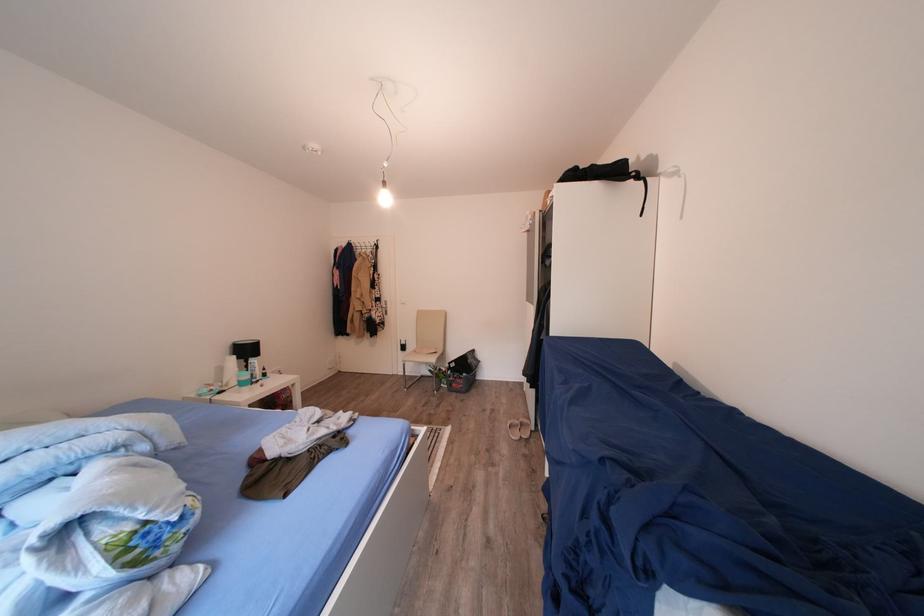
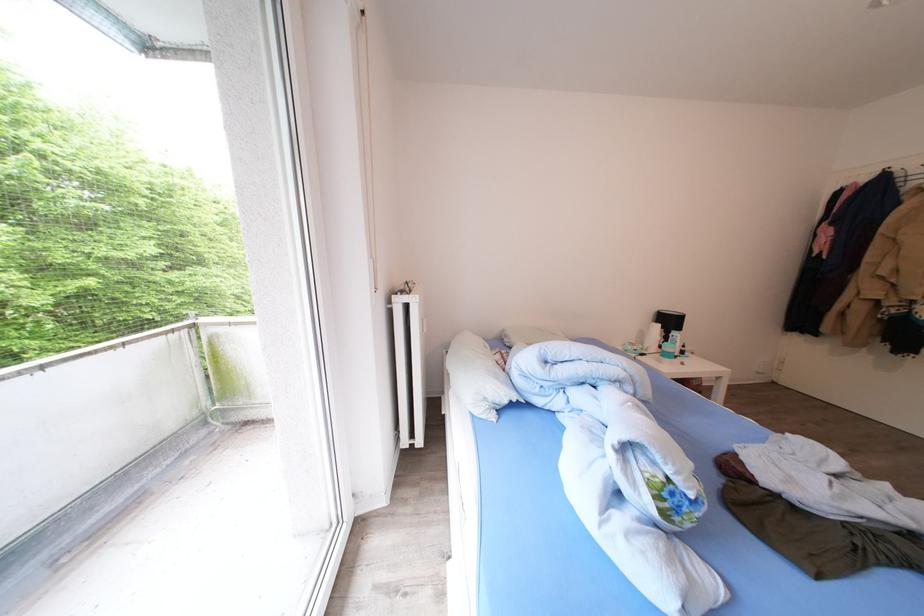
The point at (228,376) is marked in the first image. Where is the corresponding point in the second image?

(650, 339)